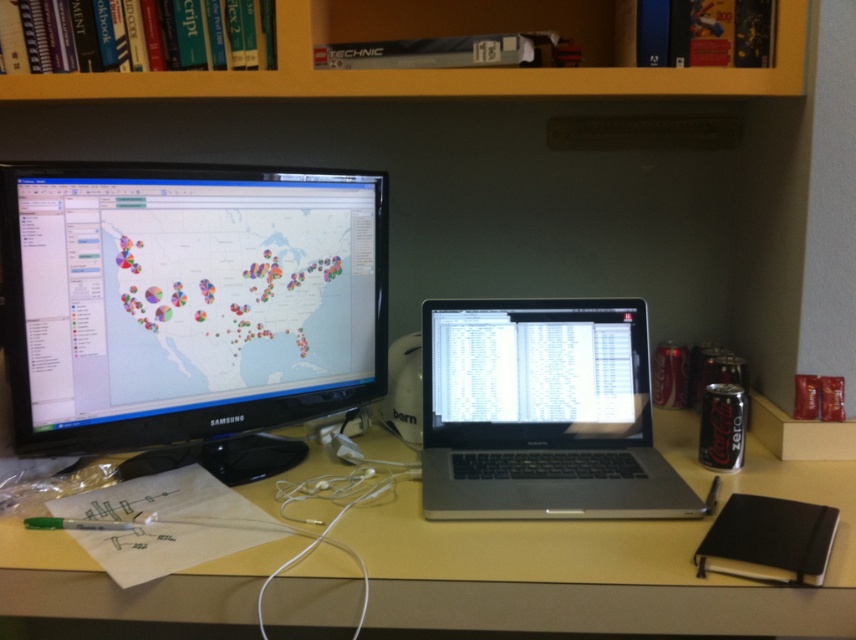
You are organizing your desk and want to place a new document holder between the sleek silver laptop at center and the yellow wood bookshelf at upper center. Based on their positions, where should you place it?

The sleek silver laptop at center is located below the yellow wood bookshelf at upper center, so you should place the document holder between them along the vertical axis, positioning it above the laptop and below the bookshelf.

You are organizing the desk and need to place a new item between the black glossy monitor at left and the yellow matte table at center. Based on their positions, where should you place the item?

Result: The black glossy monitor at left is located above the yellow matte table at center, so placing the new item between them would require positioning it below the monitor and above the table.

You are setting up a new desk arrangement and need to place a tall plant between the black glossy monitor at left and the yellow matte table at center. Since the monitor is taller than the table, where should you place the plant to ensure it doesn

The black glossy monitor at left is taller than the yellow matte table at center. To ensure the plant is visible from both screens, place it between them at a height that complements the monitor